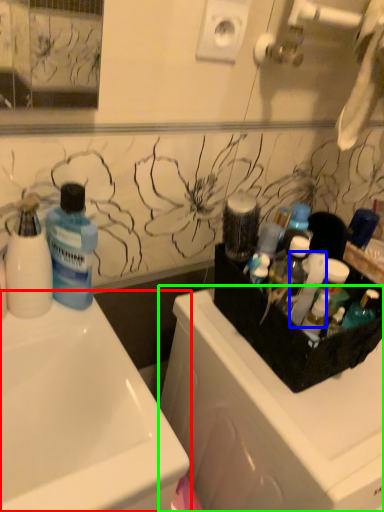
Question: Which object is the closest to the sink (highlighted by a red box)? Choose among these: cleaning product (highlighted by a blue box) or dish washer (highlighted by a green box).

Choices:
 (A) cleaning product
 (B) dish washer

Answer: (B)